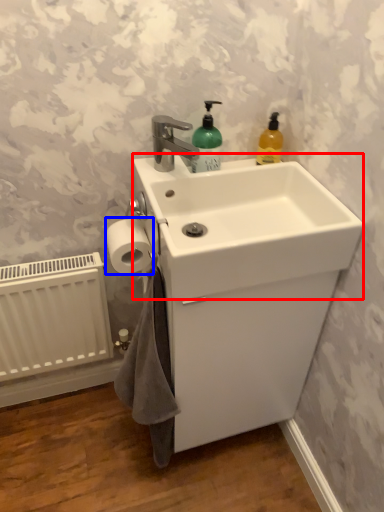
Question: Among these objects, which one is nearest to the camera, counter top (highlighted by a red box) or toilet paper (highlighted by a blue box)?

Choices:
 (A) counter top
 (B) toilet paper

Answer: (A)